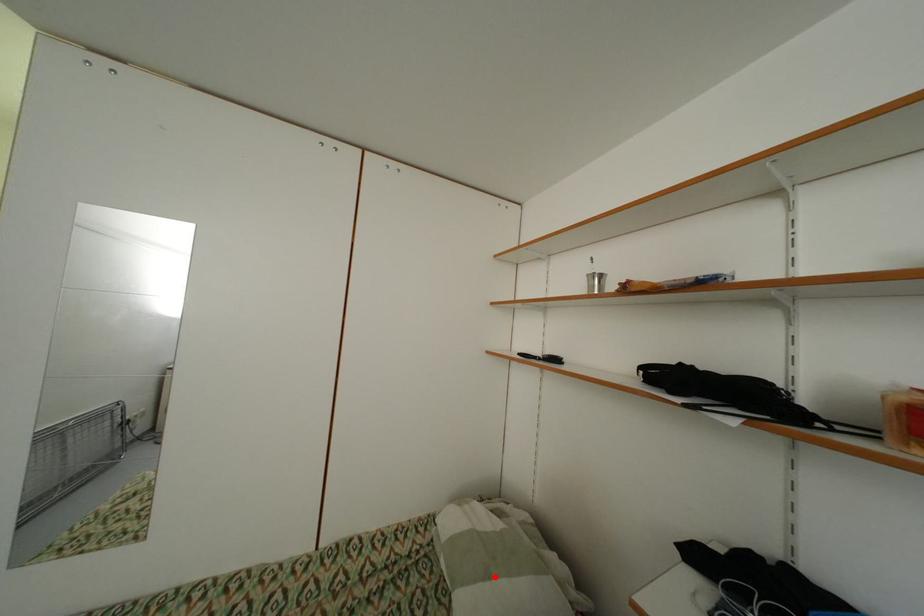
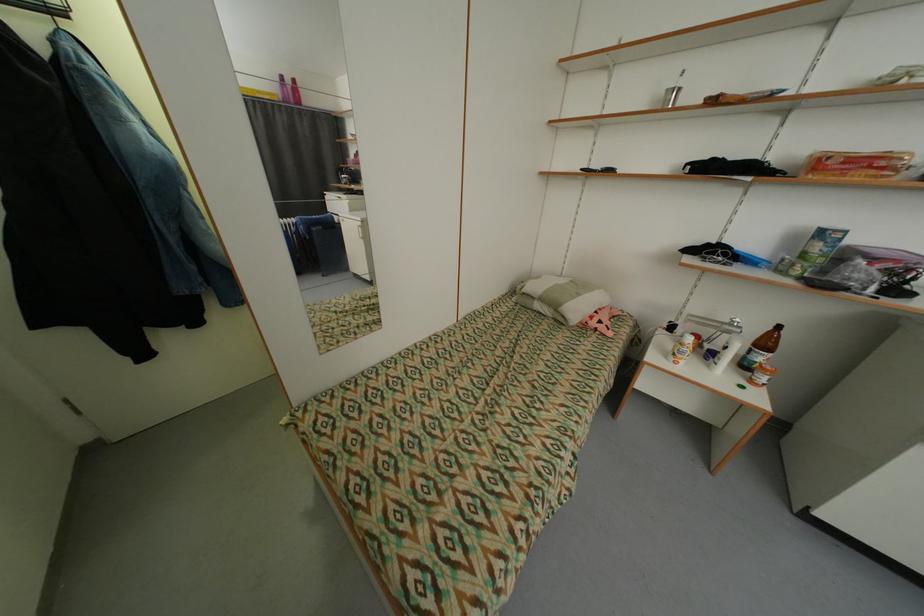
Question: I am providing you with two images of the same scene from different viewpoints. Image1 has a red point marked. In image2, the corresponding 3D location appears at what relative position? Reply with the corresponding letter.

Choices:
 (A) Closer
 (B) Farther

Answer: (A)